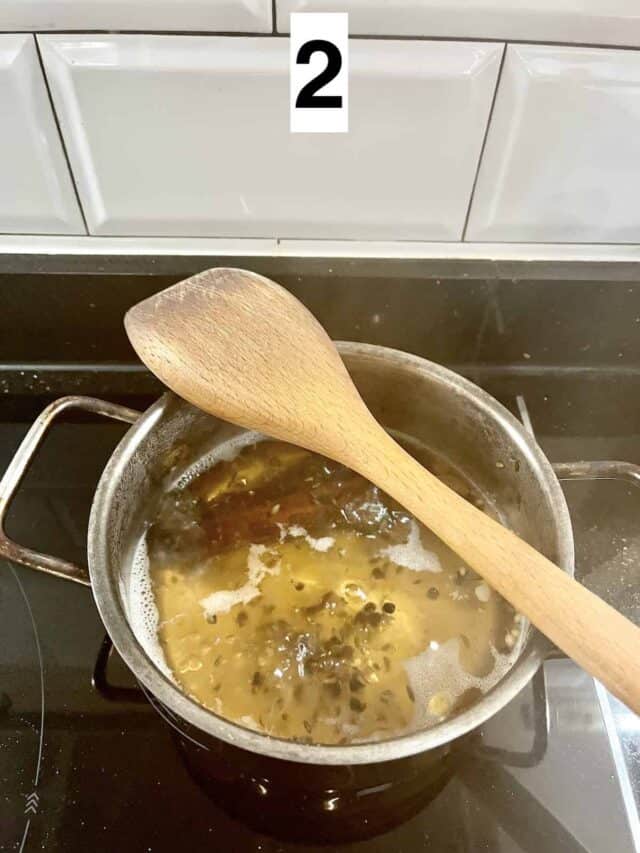
Where is `black glass stove top, electric`? black glass stove top, electric is located at coordinates (116, 769).